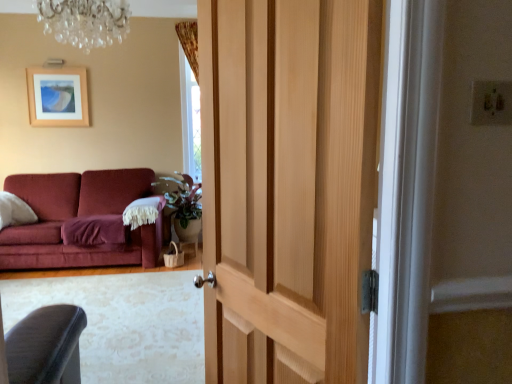
Measure the distance between point (39, 117) and camera.

Point (39, 117) and camera are 5.19 meters apart.

Measure the distance between wooden picture frame at upper left and camera.

A distance of 16.89 feet exists between wooden picture frame at upper left and camera.

Find the location of a particular element. natural wood door at center is located at coordinates (288, 186).

Looking at this image, is fuzzy woolen blanket at left oriented away from natural wood door at center?

fuzzy woolen blanket at left is not turned away from natural wood door at center.

Based on the photo, who is bigger, fuzzy woolen blanket at left or natural wood door at center?

natural wood door at center.

Can you tell me how much fuzzy woolen blanket at left and natural wood door at center differ in facing direction?

118 degrees.

Which object is thinner, fuzzy woolen blanket at left or natural wood door at center?

With smaller width is natural wood door at center.

From a real-world perspective, is natural wood door at center on crystal glass chandelier at upper center?

Incorrect, from a real-world perspective, natural wood door at center is lower than crystal glass chandelier at upper center.

Is point (260, 246) behind point (109, 29)?

No.

Is natural wood door at center situated inside crystal glass chandelier at upper center or outside?

natural wood door at center lies outside crystal glass chandelier at upper center.

Between natural wood door at center and fuzzy woolen blanket at left, which one is positioned behind?

fuzzy woolen blanket at left is more distant.

Choose the correct answer: Is natural wood door at center inside fuzzy woolen blanket at left or outside it?

natural wood door at center is located beyond the bounds of fuzzy woolen blanket at left.

Does natural wood door at center have a greater width compared to fuzzy woolen blanket at left?

No.

Which is more to the left, natural wood door at center or fuzzy woolen blanket at left?

fuzzy woolen blanket at left.

Looking at this image, is crystal glass chandelier at upper center next to fuzzy woolen blanket at left and touching it?

No, crystal glass chandelier at upper center is not making contact with fuzzy woolen blanket at left.

Based on the photo, from a real-world perspective, who is located lower, crystal glass chandelier at upper center or fuzzy woolen blanket at left?

fuzzy woolen blanket at left.

Looking at this image, considering the sizes of crystal glass chandelier at upper center and fuzzy woolen blanket at left in the image, is crystal glass chandelier at upper center taller or shorter than fuzzy woolen blanket at left?

Considering their sizes, crystal glass chandelier at upper center has more height than fuzzy woolen blanket at left.

How different are the orientations of crystal glass chandelier at upper center and fuzzy woolen blanket at left in degrees?

The angular difference between crystal glass chandelier at upper center and fuzzy woolen blanket at left is 0.987 degrees.

Is crystal glass chandelier at upper center surrounded by fuzzy woolen blanket at left?

No, crystal glass chandelier at upper center is not inside fuzzy woolen blanket at left.

What's the angular difference between fuzzy woolen blanket at left and crystal glass chandelier at upper center's facing directions?

The angular difference between fuzzy woolen blanket at left and crystal glass chandelier at upper center is 0.987 degrees.

Is the depth of fuzzy woolen blanket at left greater than that of crystal glass chandelier at upper center?

Yes.

In the scene shown: Considering the sizes of objects fuzzy woolen blanket at left and crystal glass chandelier at upper center in the image provided, who is wider, fuzzy woolen blanket at left or crystal glass chandelier at upper center?

Wider between the two is crystal glass chandelier at upper center.

Is wooden picture frame at upper left facing away from fuzzy woolen blanket at left?

wooden picture frame at upper left does not have its back to fuzzy woolen blanket at left.

How many degrees apart are the facing directions of wooden picture frame at upper left and fuzzy woolen blanket at left?

The angle between the facing direction of wooden picture frame at upper left and the facing direction of fuzzy woolen blanket at left is 2.68 degrees.

Do you think wooden picture frame at upper left is within fuzzy woolen blanket at left, or outside of it?

wooden picture frame at upper left is spatially situated outside fuzzy woolen blanket at left.

Is wooden picture frame at upper left taller or shorter than fuzzy woolen blanket at left?

Clearly, wooden picture frame at upper left is taller compared to fuzzy woolen blanket at left.

Considering the sizes of crystal glass chandelier at upper center and natural wood door at center in the image, is crystal glass chandelier at upper center taller or shorter than natural wood door at center?

crystal glass chandelier at upper center is shorter than natural wood door at center.

Does crystal glass chandelier at upper center turn towards natural wood door at center?

No, crystal glass chandelier at upper center does not turn towards natural wood door at center.

How distant is crystal glass chandelier at upper center from natural wood door at center?

crystal glass chandelier at upper center is 6.89 feet from natural wood door at center.

Would you say crystal glass chandelier at upper center is a long distance from natural wood door at center?

Yes, crystal glass chandelier at upper center and natural wood door at center are quite far apart.

Identify the location of blanket that is under the natural wood door at center (from a real-world perspective). (94, 230).

At what (x,y) coordinates should I click in order to perform the action: click on light fixture above the natural wood door at center (from the image's perspective). Please return your answer as a coordinate pair (x, y). Looking at the image, I should click on (85, 21).

Considering their positions, is crystal glass chandelier at upper center positioned further to natural wood door at center than fuzzy woolen blanket at left?

Among the two, fuzzy woolen blanket at left is located further to natural wood door at center.

Based on their spatial positions, is crystal glass chandelier at upper center or wooden picture frame at upper left further from natural wood door at center?

wooden picture frame at upper left is further to natural wood door at center.

Looking at the image, which one is located closer to fuzzy woolen blanket at left, wooden picture frame at upper left or crystal glass chandelier at upper center?

Based on the image, wooden picture frame at upper left appears to be nearer to fuzzy woolen blanket at left.

Estimate the real-world distances between objects in this image. Which object is closer to crystal glass chandelier at upper center, natural wood door at center or fuzzy woolen blanket at left?

fuzzy woolen blanket at left is closer to crystal glass chandelier at upper center.

Considering their positions, is natural wood door at center positioned closer to wooden picture frame at upper left than crystal glass chandelier at upper center?

The object closer to wooden picture frame at upper left is crystal glass chandelier at upper center.

When comparing their distances from wooden picture frame at upper left, does fuzzy woolen blanket at left or natural wood door at center seem closer?

fuzzy woolen blanket at left lies closer to wooden picture frame at upper left than the other object.

Considering their positions, is wooden picture frame at upper left positioned closer to natural wood door at center than fuzzy woolen blanket at left?

fuzzy woolen blanket at left.

Based on their spatial positions, is fuzzy woolen blanket at left or natural wood door at center closer to crystal glass chandelier at upper center?

fuzzy woolen blanket at left lies closer to crystal glass chandelier at upper center than the other object.

What are the coordinates of `blanket between natural wood door at center and wooden picture frame at upper left in the front-back direction` in the screenshot? It's located at 94,230.

Find the location of a particular element. This screenshot has width=512, height=384. light fixture between natural wood door at center and wooden picture frame at upper left in the front-back direction is located at coordinates (85, 21).

Find the location of a particular element. The image size is (512, 384). light fixture between natural wood door at center and fuzzy woolen blanket at left along the z-axis is located at coordinates (85, 21).

Where is `blanket located between crystal glass chandelier at upper center and wooden picture frame at upper left in the depth direction`? The width and height of the screenshot is (512, 384). blanket located between crystal glass chandelier at upper center and wooden picture frame at upper left in the depth direction is located at coordinates (94, 230).